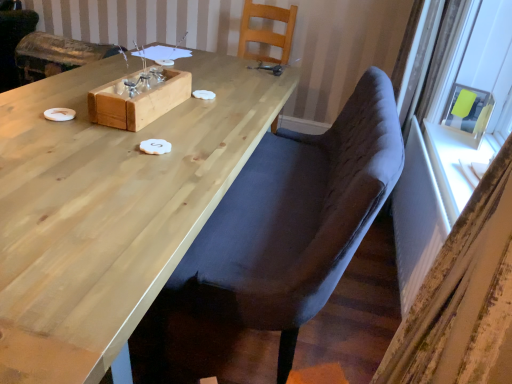
Where is `free point to the left of wooden box at center`? free point to the left of wooden box at center is located at coordinates (46, 104).